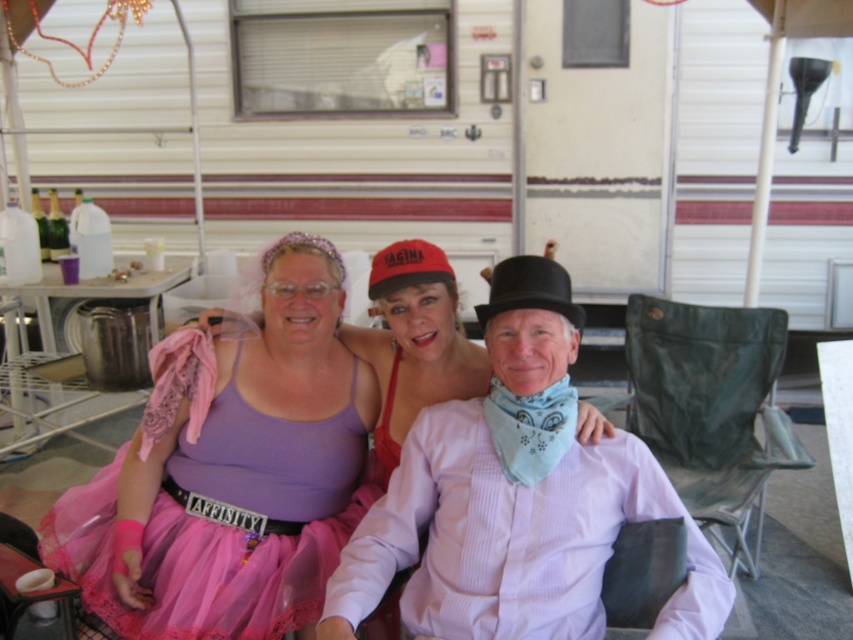
Question: Is white plastic recreational vehicle at center thinner than light pink cotton shirt at center?

Choices:
 (A) yes
 (B) no

Answer: (B)

Question: Which of these objects is positioned closest to the pink tulle dress at center?

Choices:
 (A) white plastic recreational vehicle at center
 (B) light pink cotton shirt at center

Answer: (B)

Question: Can you confirm if white plastic recreational vehicle at center is positioned above pink tulle dress at center?

Choices:
 (A) no
 (B) yes

Answer: (B)

Question: Which point is closer to the camera?

Choices:
 (A) white plastic recreational vehicle at center
 (B) pink tulle dress at center
 (C) light pink cotton shirt at center

Answer: (C)

Question: Which of the following is the farthest from the observer?

Choices:
 (A) (171, 461)
 (B) (485, 544)
 (C) (787, 301)

Answer: (C)

Question: Does white plastic recreational vehicle at center appear on the right side of light pink cotton shirt at center?

Choices:
 (A) no
 (B) yes

Answer: (A)